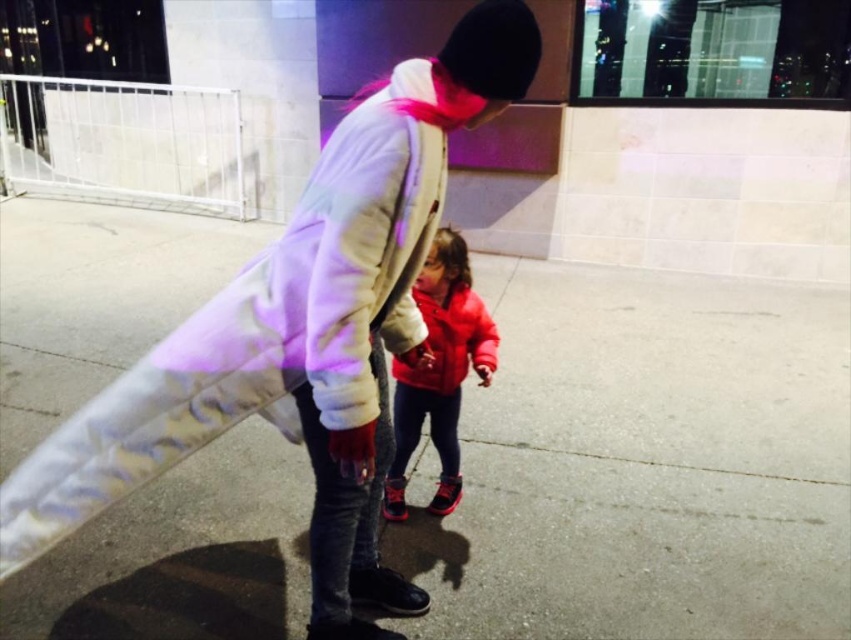
You are a photographer standing at the back of the plaza. You want to take a photo of the white fleece jacket at center and matte red jacket at center so both are clearly visible. Which jacket should you focus on first to ensure both are in focus?

The white fleece jacket at center is closer to the viewer than the matte red jacket at center. To ensure both are in focus, you should focus on the matte red jacket at center first because focusing on the farther object first allows the depth of field to cover both closer and farther subjects more effectively.

You are standing at the origin point of the image. Which object is located at the coordinates point (300, 333)?

The white fleece jacket at center is located at point (300, 333).

You are standing on the plaza and want to walk to the metal fence on the left. The point marked at coordinates (643, 464) is the center of the plaza. Which direction should you walk to reach the metal fence on the left?

The point at coordinates (643, 464) is the center of the plaza, so to reach the metal fence on the left, you should walk towards the left from the center.